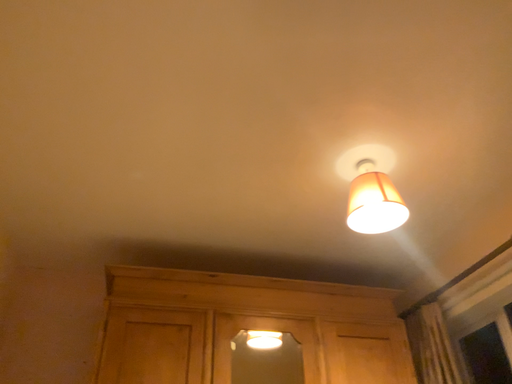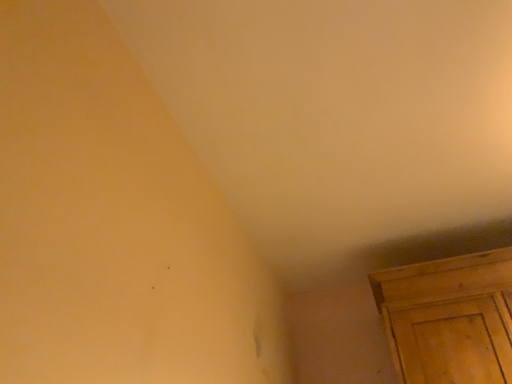
Question: How did the camera likely rotate when shooting the video?

Choices:
 (A) rotated right
 (B) rotated left

Answer: (B)